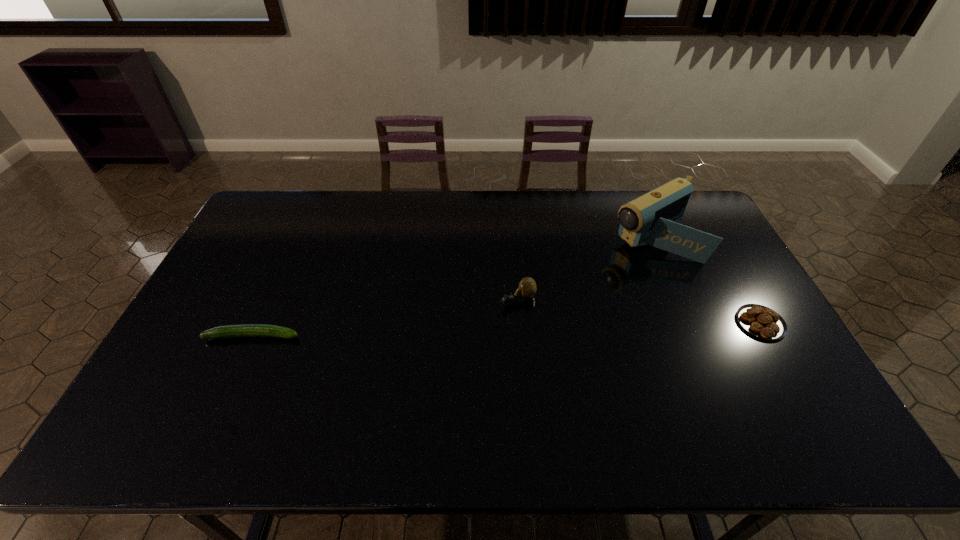
Where is `free space on the desktop that is between the leftmost object and the pastry and is positioned on the front-facing side of the third object from right to left`? The width and height of the screenshot is (960, 540). free space on the desktop that is between the leftmost object and the pastry and is positioned on the front-facing side of the third object from right to left is located at coordinates (454, 331).

You are a GUI agent. You are given a task and a screenshot of the screen. Output one action in this format:
    pyautogui.click(x=<x>, y=<y>)
    Task: Click on the free space on the desktop that is between the zucchini and the pastry and is positioned on the side of the camcorder with the flip-out screen
    The image size is (960, 540).
    Given the screenshot: What is the action you would take?
    pyautogui.click(x=491, y=330)